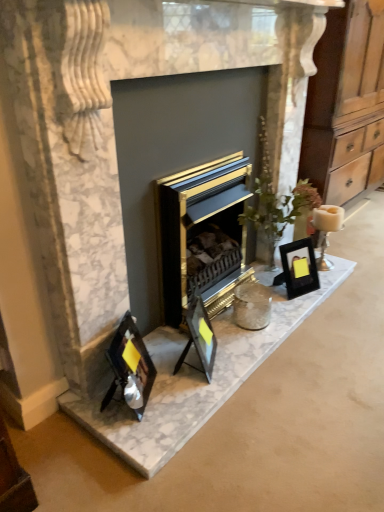
Question: Is black glass photo frames at lower left taller than gold metallic fireplace at center?

Choices:
 (A) yes
 (B) no

Answer: (B)

Question: From the image's perspective, is black glass photo frames at lower left above gold metallic fireplace at center?

Choices:
 (A) no
 (B) yes

Answer: (A)

Question: Considering the relative positions of black glass photo frames at lower left and gold metallic fireplace at center in the image provided, is black glass photo frames at lower left to the right of gold metallic fireplace at center from the viewer's perspective?

Choices:
 (A) yes
 (B) no

Answer: (B)

Question: From a real-world perspective, is black glass photo frames at lower left located higher than gold metallic fireplace at center?

Choices:
 (A) yes
 (B) no

Answer: (B)

Question: Is black glass photo frames at lower left oriented away from gold metallic fireplace at center?

Choices:
 (A) yes
 (B) no

Answer: (A)

Question: Is black glass photo frames at lower left shorter than gold metallic fireplace at center?

Choices:
 (A) yes
 (B) no

Answer: (A)

Question: Is gold metallic fireplace at center positioned behind metallic silver photo frame at lower left, which is the third picture frame in right-to-left order?

Choices:
 (A) no
 (B) yes

Answer: (B)

Question: Can you confirm if gold metallic fireplace at center is smaller than metallic silver photo frame at lower left, which is the third picture frame in right-to-left order?

Choices:
 (A) yes
 (B) no

Answer: (B)

Question: Would you say gold metallic fireplace at center is outside metallic silver photo frame at lower left, the 3th picture frame in the back-to-front sequence?

Choices:
 (A) no
 (B) yes

Answer: (B)

Question: From the image's perspective, is gold metallic fireplace at center under metallic silver photo frame at lower left, the 3th picture frame in the back-to-front sequence?

Choices:
 (A) no
 (B) yes

Answer: (A)

Question: Does gold metallic fireplace at center appear on the right side of metallic silver photo frame at lower left, arranged as the first picture frame when viewed from the front?

Choices:
 (A) no
 (B) yes

Answer: (B)

Question: Can you confirm if gold metallic fireplace at center is shorter than metallic silver photo frame at lower left, the 3th picture frame in the back-to-front sequence?

Choices:
 (A) yes
 (B) no

Answer: (B)

Question: Is black glass photo frame at center, the 3th picture frame positioned from the left, outside white ceramic candle at right?

Choices:
 (A) no
 (B) yes

Answer: (B)